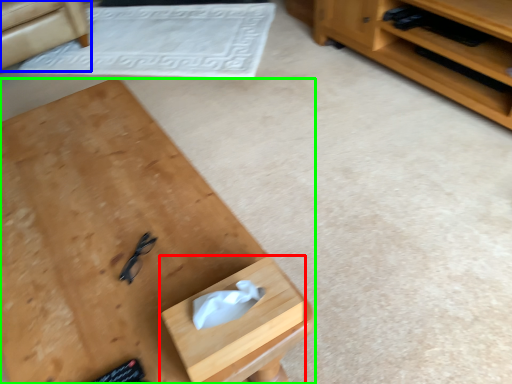
Question: Considering the real-world distances, which object is closest to drawer (highlighted by a red box)? armchair (highlighted by a blue box) or desk (highlighted by a green box).

Choices:
 (A) armchair
 (B) desk

Answer: (B)